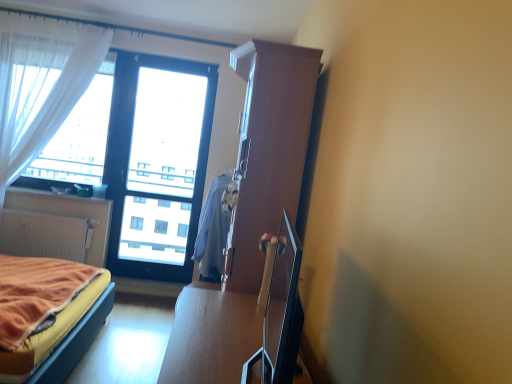
Question: Looking at the image, does light blue fabric at center seem bigger or smaller compared to white sheer curtain at left?

Choices:
 (A) big
 (B) small

Answer: (A)

Question: Considering their positions, is light blue fabric at center located in front of or behind white sheer curtain at left?

Choices:
 (A) behind
 (B) front

Answer: (B)

Question: Based on their relative distances, which object is nearer to the light blue fabric at center?

Choices:
 (A) white sheer curtain at left
 (B) matte white radiator at lower left
 (C) velvet orange bed at lower left
 (D) transparent glass window at center

Answer: (C)

Question: Based on their relative distances, which object is nearer to the velvet orange bed at lower left?

Choices:
 (A) transparent glass window at center
 (B) white sheer curtain at left
 (C) light blue fabric at center
 (D) matte white radiator at lower left

Answer: (C)